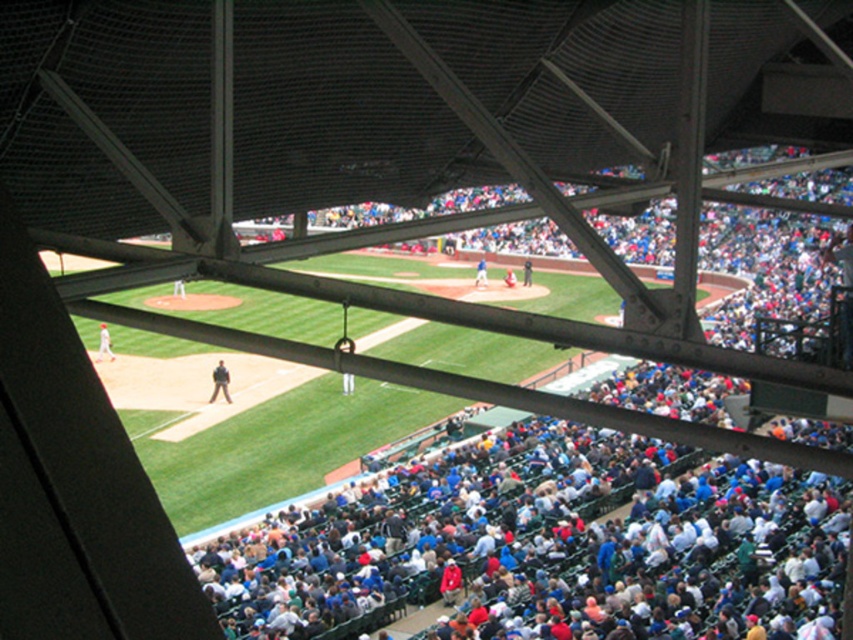
You are a photographer standing in the stadium and want to take a photo of the blue jersey at center and the dark blue uniform at center. Which one is on the left when you look at them from your current position?

The blue jersey at center is positioned on the left side of the dark blue uniform at center, so when looking from your current position, the blue jersey at center is on the left.

You are a photographer trying to capture a clear shot of both the light brown leather jacket at center and the dark blue uniform at center. Since the stadium framework partially blocks your view, you need to adjust your position. Considering their sizes, which object should you prioritize zooming in on to ensure it remains visible in your photo?

The light brown leather jacket at center is thinner than the dark blue uniform at center, so you should prioritize zooming in on the light brown leather jacket at center to ensure it remains visible since it is smaller and might be harder to capture clearly.

You are a photographer standing at the edge of the stadium, trying to capture a photo of both the red uniformed person at lower left and the blue uniformed player at center. Considering their sizes in the frame, which one should you zoom in on first to ensure both are clearly visible in the photo?

The red uniformed person at lower left is larger in the frame than the blue uniformed player at center. To ensure both are clearly visible, you should zoom in on the blue uniformed player at center first, as they are smaller and require closer focus to capture details without cropping the larger figure.